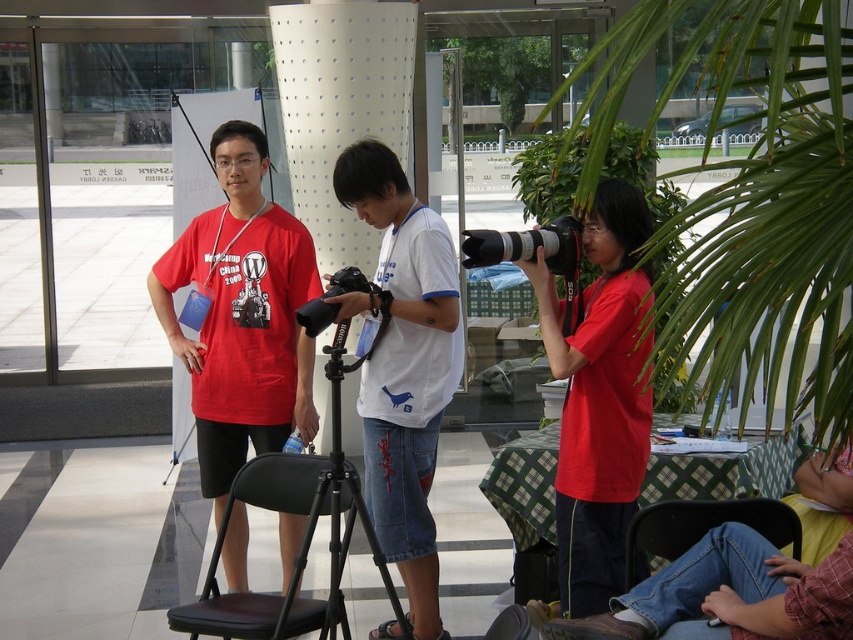
You are a photographer at the event and need to adjust the camera on the tripod. Which object should you move first, the matte red shirt at center or the black metal tripod at center?

The matte red shirt at center is located above the black metal tripod at center, so you should move the matte red shirt at center first before adjusting the black metal tripod at center.

You are standing at point (335, 566) and want to walk to point (437, 312). According to the scene description, which direction should you move? Please answer with either left, right, forward, or backward.

You should move backward because point (437, 312) is behind point (335, 566).

You are standing in the modern building with the patterned floor. You see a point at coordinates [599,397]. What object is located at that point?

The point at coordinates [599,397] corresponds to the matte red shirt at center.